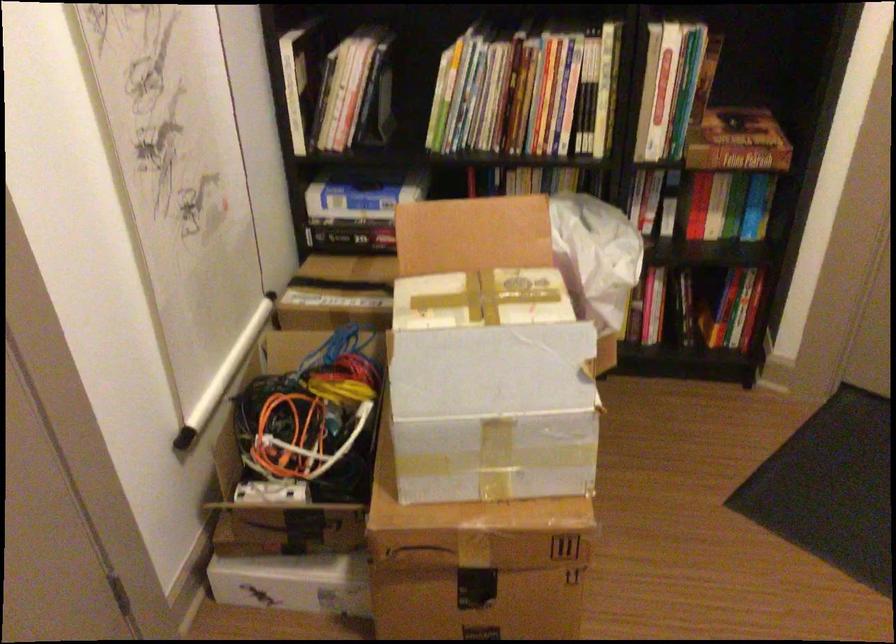
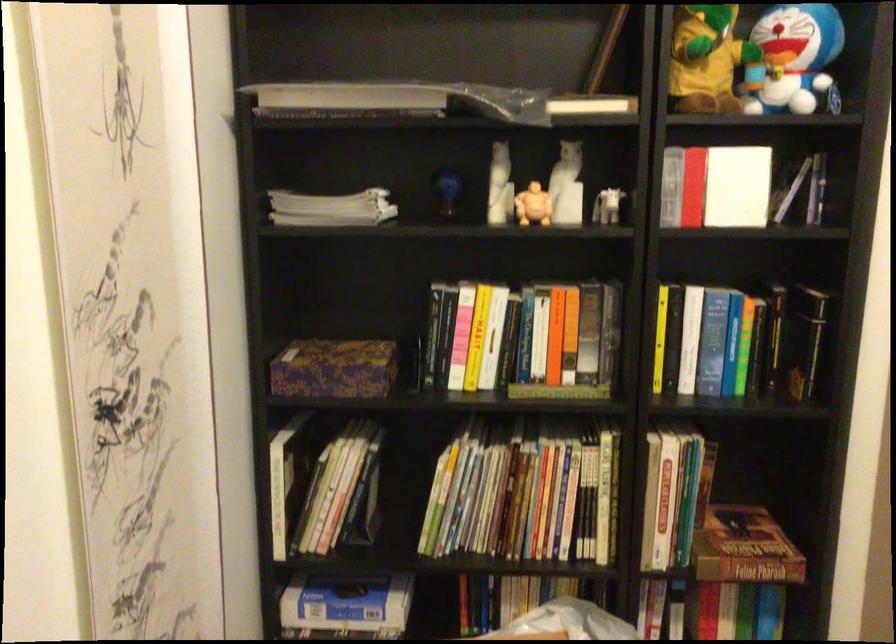
In a continuous first-person perspective shot, in which direction is the camera moving?

The movement direction of the cameraman is left, forward.